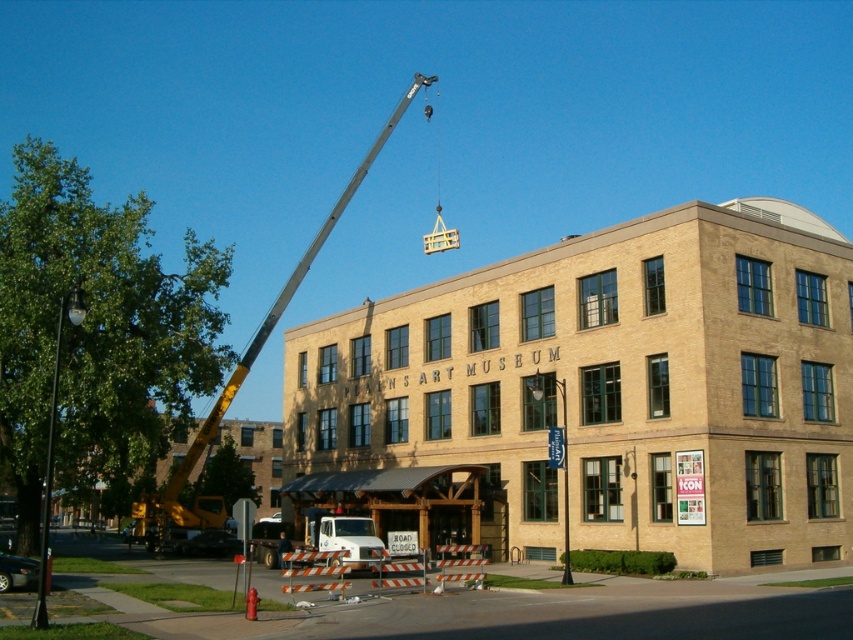
Does beige brick building at center have a larger size compared to white plastic lift at center?

Yes, beige brick building at center is bigger than white plastic lift at center.

Is point (694, 273) positioned before point (329, 520)?

No, it is behind (329, 520).

Describe the element at coordinates (612, 387) in the screenshot. This screenshot has height=640, width=853. I see `beige brick building at center` at that location.

The width and height of the screenshot is (853, 640). What are the coordinates of `beige brick building at center` in the screenshot? It's located at (612, 387).

Can you confirm if yellow metallic crane at upper left is wider than white plastic lift at center?

Yes.

Which is more to the right, yellow metallic crane at upper left or white plastic lift at center?

Positioned to the right is white plastic lift at center.

Who is more forward, [386,136] or [368,531]?

Point [368,531]

At what (x,y) coordinates should I click in order to perform the action: click on yellow metallic crane at upper left. Please return your answer as a coordinate pair (x, y). This screenshot has width=853, height=640. Looking at the image, I should click on (251, 362).

Who is shorter, beige brick building at center or yellow metallic crane at upper left?

beige brick building at center

Which is more to the left, beige brick building at center or yellow metallic crane at upper left?

yellow metallic crane at upper left is more to the left.

This screenshot has height=640, width=853. I want to click on beige brick building at center, so click(612, 387).